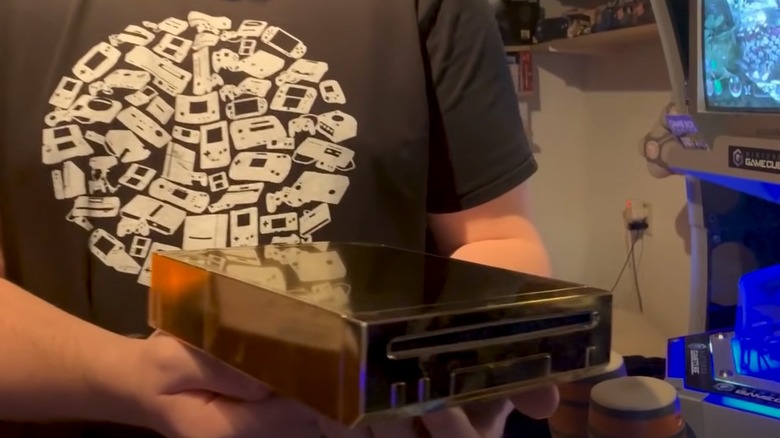
The height and width of the screenshot is (438, 780). What are the coordinates of `outlet` in the screenshot? It's located at (632, 218).